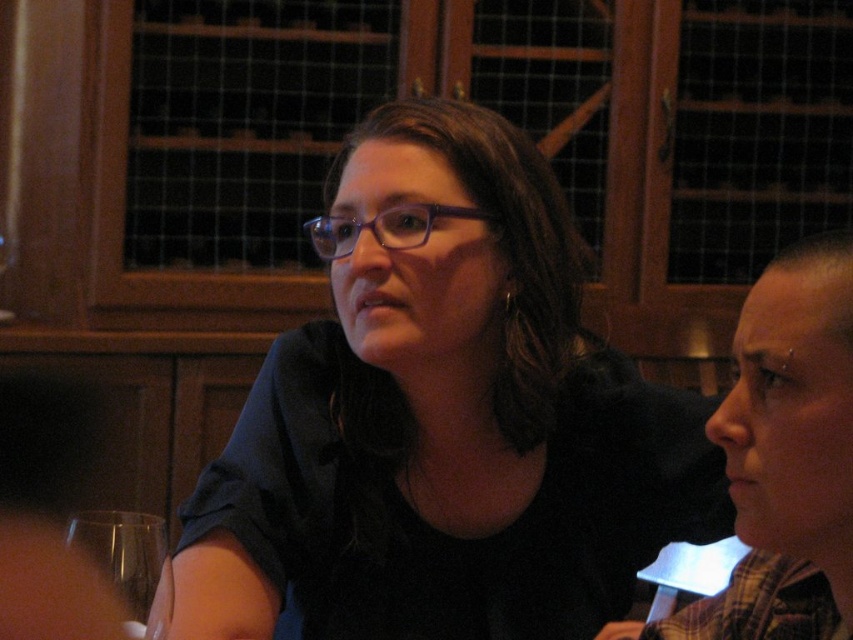
You are a waiter in a restaurant and need to place a new wine glass on the table without it touching any existing items. The table has the matte black shirt at center and the transparent glass at lower left. What is the minimum distance you should keep the new glass from the existing items?

The matte black shirt at center is 14.36 inches away from the transparent glass at lower left. To ensure the new glass doesn not touch any existing items, it should be placed at least 14.36 inches away from both the matte black shirt at center and the transparent glass at lower left.

You are a photographer setting up a shot of the scene described. You need to position a light source to the left of the transparent glass at lower left. Will this light source also be to the left of the matte black shirt at center?

Yes, since the matte black shirt at center is to the right of the transparent glass at lower left, placing the light source to the left of the transparent glass at lower left would also place it to the left of the matte black shirt at center.